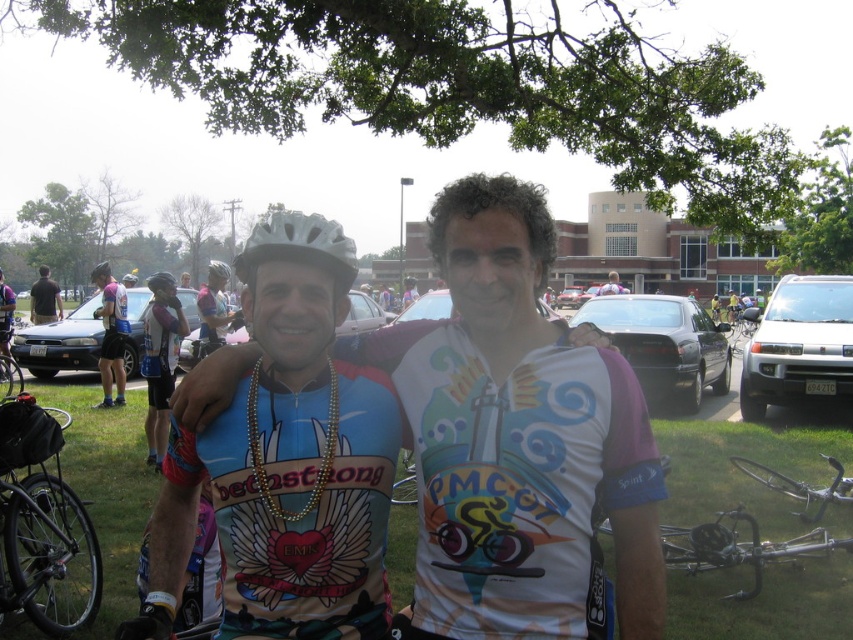
Is black matte bicycle at lower left bigger than silver metallic helmet at center?

Yes, black matte bicycle at lower left is bigger than silver metallic helmet at center.

Does black matte bicycle at lower left have a lesser height compared to silver metallic helmet at center?

No.

What do you see at coordinates (42, 525) in the screenshot? I see `black matte bicycle at lower left` at bounding box center [42, 525].

Where is `black matte bicycle at lower left`? The image size is (853, 640). black matte bicycle at lower left is located at coordinates (42, 525).

Who is shorter, matte black cycling jersey at left or dark blue shirt at left?

With less height is dark blue shirt at left.

Which is below, matte black cycling jersey at left or dark blue shirt at left?

matte black cycling jersey at left is lower down.

This screenshot has height=640, width=853. Identify the location of matte black cycling jersey at left. (111, 333).

What are the coordinates of `matte black cycling jersey at left` in the screenshot? It's located at coord(111,333).

Does matte black cycling jersey at left have a lesser height compared to white helmet at center?

Yes.

Does matte black cycling jersey at left come in front of white helmet at center?

Yes, matte black cycling jersey at left is in front of white helmet at center.

What are the coordinates of `matte black cycling jersey at left` in the screenshot? It's located at (111, 333).